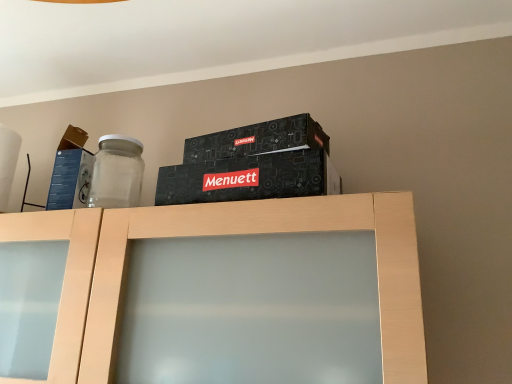
Question: Does blue cardboard box at left have a lesser height compared to light wood cabinet at center?

Choices:
 (A) yes
 (B) no

Answer: (A)

Question: From a real-world perspective, is blue cardboard box at left located higher than light wood cabinet at center?

Choices:
 (A) no
 (B) yes

Answer: (B)

Question: Is blue cardboard box at left positioned far away from light wood cabinet at center?

Choices:
 (A) no
 (B) yes

Answer: (A)

Question: Would you say light wood cabinet at center is part of blue cardboard box at left's contents?

Choices:
 (A) yes
 (B) no

Answer: (B)

Question: Is blue cardboard box at left smaller than light wood cabinet at center?

Choices:
 (A) no
 (B) yes

Answer: (B)

Question: Can you confirm if blue cardboard box at left is taller than light wood cabinet at center?

Choices:
 (A) yes
 (B) no

Answer: (B)

Question: From a real-world perspective, is light wood cabinet at center below blue cardboard box at left?

Choices:
 (A) no
 (B) yes

Answer: (B)

Question: From the image's perspective, is light wood cabinet at center located beneath blue cardboard box at left?

Choices:
 (A) yes
 (B) no

Answer: (A)

Question: Is light wood cabinet at center turned away from blue cardboard box at left?

Choices:
 (A) no
 (B) yes

Answer: (A)

Question: Is light wood cabinet at center located outside blue cardboard box at left?

Choices:
 (A) yes
 (B) no

Answer: (A)

Question: Does light wood cabinet at center have a lesser width compared to blue cardboard box at left?

Choices:
 (A) no
 (B) yes

Answer: (A)

Question: Is blue cardboard box at left a part of light wood cabinet at center?

Choices:
 (A) yes
 (B) no

Answer: (B)

Question: From the image's perspective, is blue cardboard box at left positioned above or below light wood cabinet at center?

Choices:
 (A) below
 (B) above

Answer: (B)